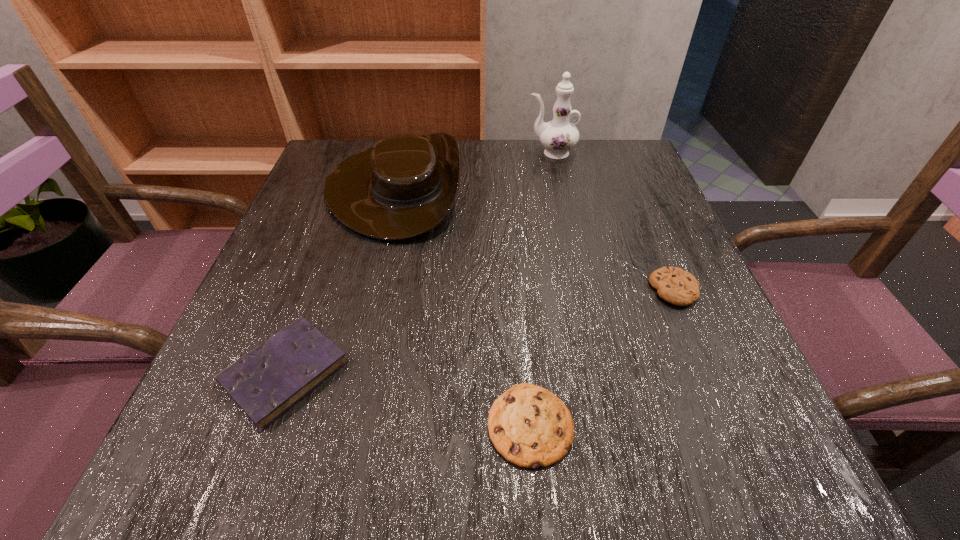
Find the location of a particular element. This screenshot has height=540, width=960. vacant area at the far right corner of the desktop is located at coordinates (598, 174).

Find the location of `free region at the near right corner of the desktop`. free region at the near right corner of the desktop is located at coordinates click(x=779, y=460).

Where is `free space between the cowboy hat and the left cookie`? free space between the cowboy hat and the left cookie is located at coordinates (463, 306).

Where is `empty space that is in between the tallest object and the farther cookie`? empty space that is in between the tallest object and the farther cookie is located at coordinates (612, 221).

Where is `blank region between the tallest object and the shortest object`? This screenshot has width=960, height=540. blank region between the tallest object and the shortest object is located at coordinates (540, 289).

Locate an element on the screen. The image size is (960, 540). vacant space that is in between the diary and the tallest object is located at coordinates (418, 262).

You are a GUI agent. You are given a task and a screenshot of the screen. Output one action in this format:
    pyautogui.click(x=<x>, y=<y>)
    Task: Click on the free spot between the fourth shortest object and the diary
    The width and height of the screenshot is (960, 540).
    Given the screenshot: What is the action you would take?
    pyautogui.click(x=340, y=280)

Locate an element on the screen. free space between the tallest object and the right cookie is located at coordinates (612, 221).

Locate an element on the screen. The image size is (960, 540). unoccupied area between the farther cookie and the diary is located at coordinates (479, 331).

I want to click on vacant space in between the shortest object and the tallest object, so [x=540, y=289].